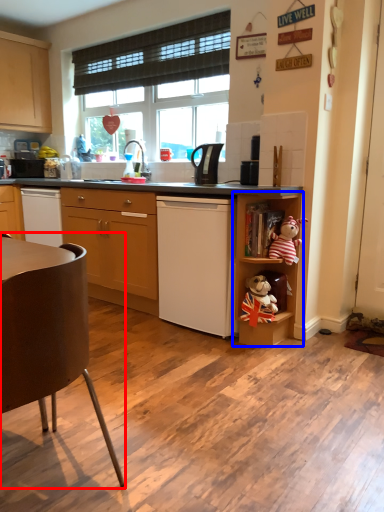
Question: Which point is further to the camera, chair (highlighted by a red box) or shelf (highlighted by a blue box)?

Choices:
 (A) chair
 (B) shelf

Answer: (B)